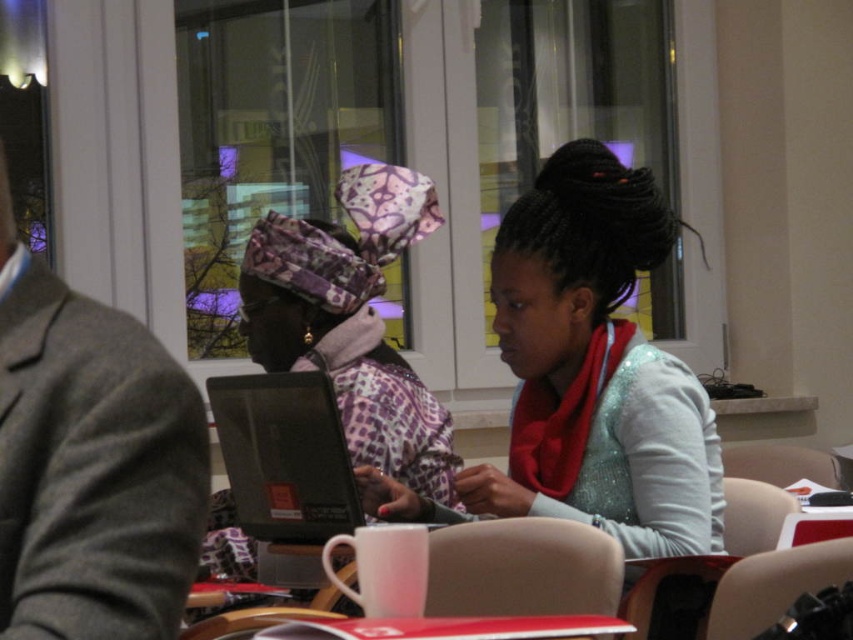
The width and height of the screenshot is (853, 640). Describe the element at coordinates (91, 461) in the screenshot. I see `gray wool jacket at left` at that location.

You are a GUI agent. You are given a task and a screenshot of the screen. Output one action in this format:
    pyautogui.click(x=<x>, y=<y>)
    Task: Click on the gray wool jacket at left
    This screenshot has width=853, height=640.
    Given the screenshot: What is the action you would take?
    pyautogui.click(x=91, y=461)

In the scene shown: Does satin silver scarf at center have a greater width compared to black glossy laptop at center?

Yes, satin silver scarf at center is wider than black glossy laptop at center.

Between satin silver scarf at center and black glossy laptop at center, which one has more height?

With more height is satin silver scarf at center.

Is point (660, 451) positioned behind point (344, 460)?

No.

At what (x,y) coordinates should I click in order to perform the action: click on satin silver scarf at center. Please return your answer as a coordinate pair (x, y). The height and width of the screenshot is (640, 853). Looking at the image, I should click on (595, 369).

Is satin silver scarf at center shorter than gray wool jacket at left?

No, satin silver scarf at center is not shorter than gray wool jacket at left.

Which is behind, point (553, 336) or point (48, 275)?

Positioned behind is point (553, 336).

Which is in front, point (503, 508) or point (33, 429)?

Point (33, 429) is more forward.

Where is `satin silver scarf at center`? This screenshot has width=853, height=640. satin silver scarf at center is located at coordinates (595, 369).